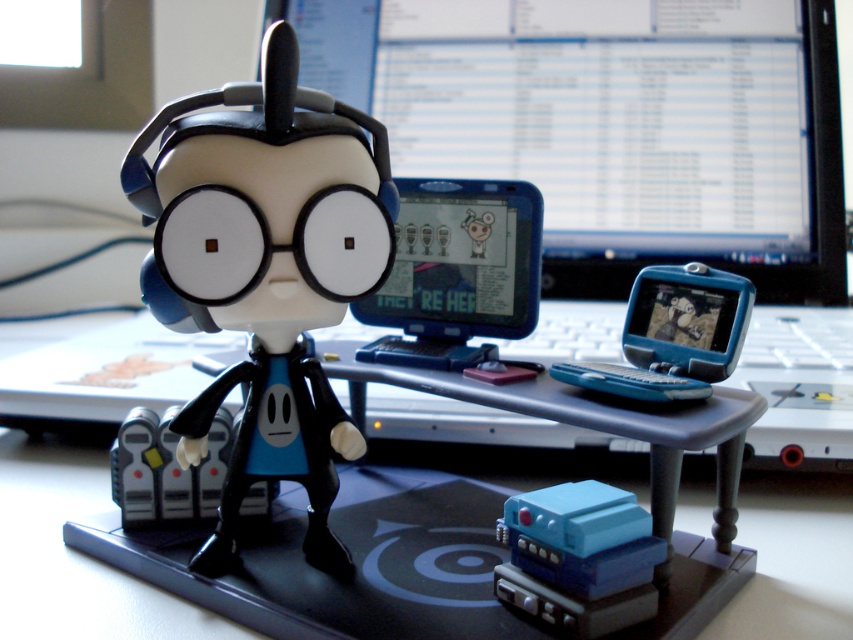
You are setting up a display for a convention and need to place the matte black figurine at center on top of the black plastic computer desk at center. Is this possible given their positions?

The matte black figurine at center is positioned over black plastic computer desk at center, so yes, it can be placed on top of the desk as described.

You are holding a measuring tool that can only measure distances up to 20 inches. You need to determine the distance between you and the point at coordinates point (253,184). Can your tool measure this distance?

The distance between you and the point (253,184) is 21.05 inches, which exceeds the measuring tool limit of 20 inches. Therefore, the tool cannot measure this distance.

You are a small toy mouse that is 5 cm tall. You want to climb onto the black plastic computer desk at center and the blue plastic toy at center. Which one can you easily climb onto?

The blue plastic toy at center is shorter than the black plastic computer desk at center, so the toy mouse can easily climb onto the blue plastic toy at center.